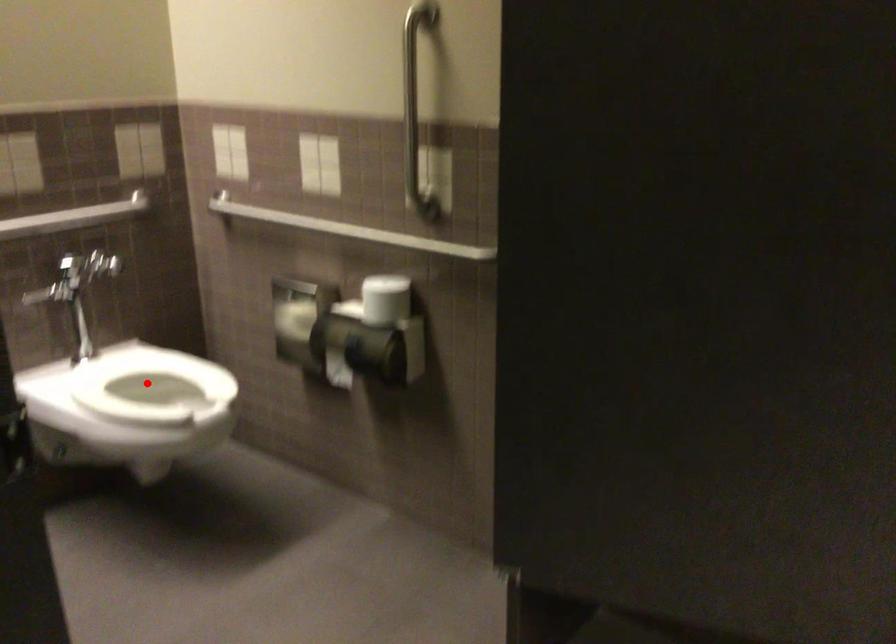
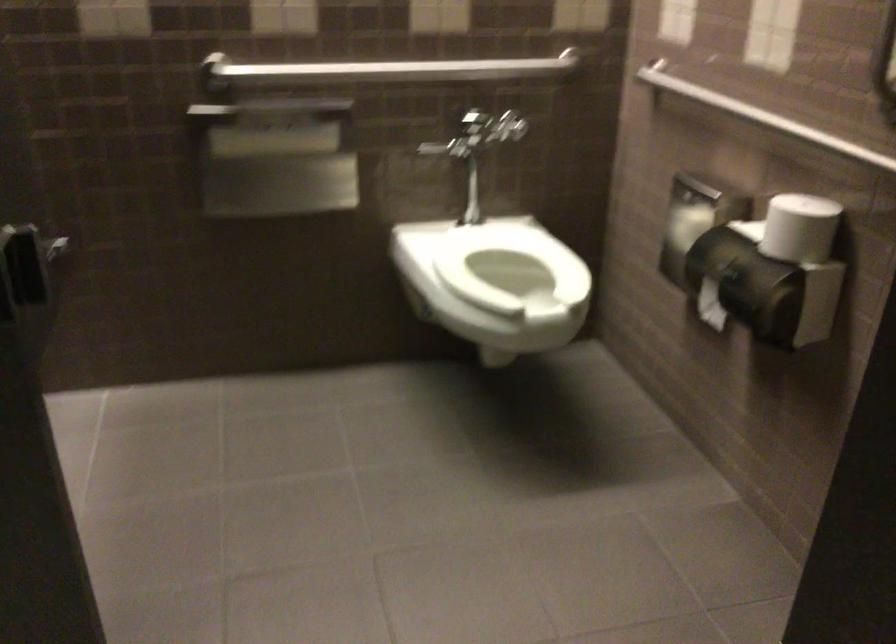
Question: I am providing you with two images of the same scene from different viewpoints. A red point is marked on the first image. Is the red point's position out of view in image 2?

Choices:
 (A) Yes
 (B) No

Answer: (B)